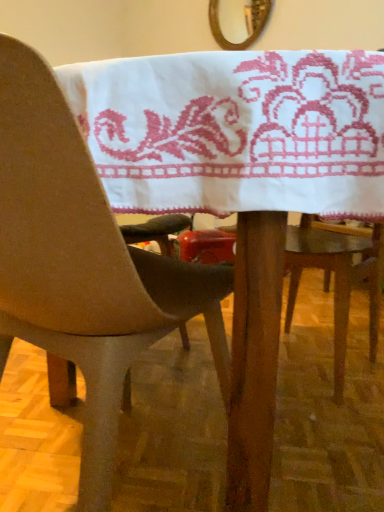
Question: Should I look upward or downward to see wooden frame mirror at upper center?

Choices:
 (A) up
 (B) down

Answer: (A)

Question: Could you tell me if wooden frame mirror at upper center is facing matte plastic chair at center?

Choices:
 (A) no
 (B) yes

Answer: (A)

Question: Does wooden frame mirror at upper center appear on the left side of matte plastic chair at center?

Choices:
 (A) yes
 (B) no

Answer: (B)

Question: Is the position of wooden frame mirror at upper center more distant than that of matte plastic chair at center?

Choices:
 (A) no
 (B) yes

Answer: (B)

Question: Is wooden frame mirror at upper center taller than matte plastic chair at center?

Choices:
 (A) no
 (B) yes

Answer: (A)

Question: Can you confirm if wooden frame mirror at upper center is smaller than matte plastic chair at center?

Choices:
 (A) yes
 (B) no

Answer: (A)

Question: Is wooden frame mirror at upper center next to matte plastic chair at center?

Choices:
 (A) no
 (B) yes

Answer: (A)

Question: Is matte plastic chair at center placed right next to wooden frame mirror at upper center?

Choices:
 (A) no
 (B) yes

Answer: (A)

Question: Could you tell me if matte plastic chair at center is turned towards wooden frame mirror at upper center?

Choices:
 (A) yes
 (B) no

Answer: (B)

Question: Is matte plastic chair at center wider than wooden frame mirror at upper center?

Choices:
 (A) no
 (B) yes

Answer: (B)

Question: Is matte plastic chair at center turned away from wooden frame mirror at upper center?

Choices:
 (A) yes
 (B) no

Answer: (B)

Question: From the image's perspective, does matte plastic chair at center appear lower than wooden frame mirror at upper center?

Choices:
 (A) no
 (B) yes

Answer: (B)

Question: From a real-world perspective, does matte plastic chair at center stand above wooden frame mirror at upper center?

Choices:
 (A) no
 (B) yes

Answer: (A)

Question: Considering the positions of matte plastic chair at center and wooden frame mirror at upper center in the image, is matte plastic chair at center taller or shorter than wooden frame mirror at upper center?

Choices:
 (A) tall
 (B) short

Answer: (A)